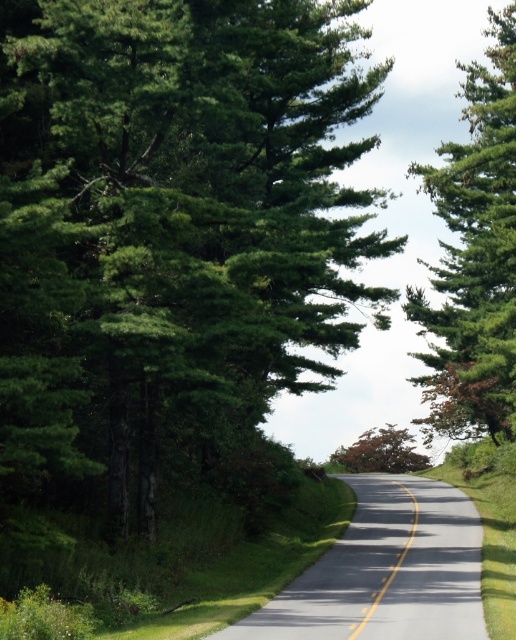
Can you confirm if green matte tree at center is positioned to the right of yellow solid line at center?

Indeed, green matte tree at center is positioned on the right side of yellow solid line at center.

Is point (496, 140) farther from camera compared to point (416, 506)?

No.

The width and height of the screenshot is (516, 640). Describe the element at coordinates (475, 257) in the screenshot. I see `green matte tree at center` at that location.

I want to click on green matte tree at center, so click(x=475, y=257).

Is point (279, 234) closer to viewer compared to point (448, 266)?

That is True.

Who is taller, green matte tree at left or green matte tree at center?

With more height is green matte tree at center.

The height and width of the screenshot is (640, 516). Find the location of `green matte tree at left`. green matte tree at left is located at coordinates (173, 237).

Where is `green matte tree at left`? green matte tree at left is located at coordinates (173, 237).

Can you confirm if green matte tree at left is positioned to the left of yellow solid line at center?

Indeed, green matte tree at left is positioned on the left side of yellow solid line at center.

Can you confirm if green matte tree at left is shorter than yellow solid line at center?

No, green matte tree at left is not shorter than yellow solid line at center.

In order to click on green matte tree at left in this screenshot , I will do `click(173, 237)`.